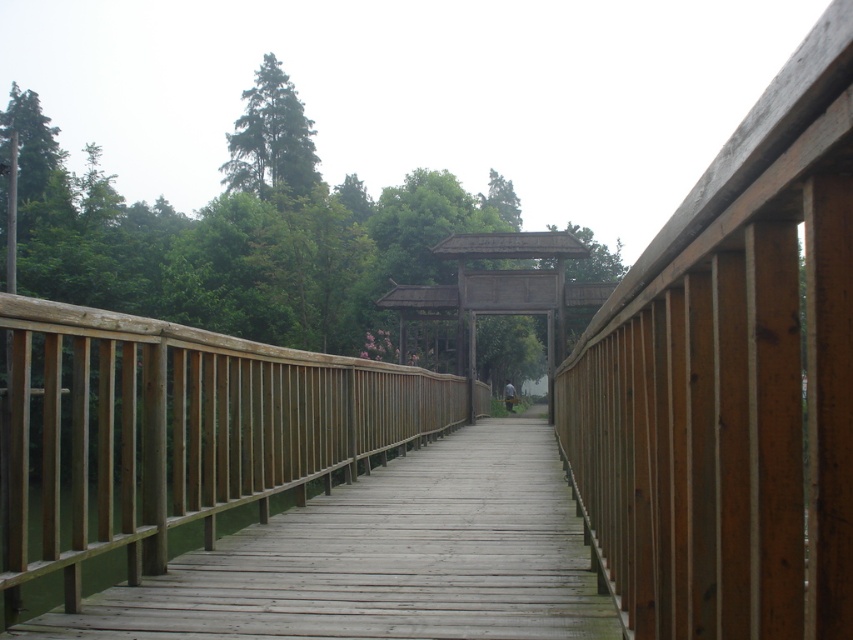
Is wooden at center below green matte tree at upper center?

Yes, wooden at center is below green matte tree at upper center.

Which is in front, point (497, 420) or point (228, 189)?

Point (497, 420) is more forward.

At what (x,y) coordinates should I click in order to perform the action: click on wooden at center. Please return your answer as a coordinate pair (x, y). The height and width of the screenshot is (640, 853). Looking at the image, I should click on (386, 557).

The image size is (853, 640). What are the coordinates of `wooden at center` in the screenshot? It's located at (386, 557).

Is wooden at center behind wooden gate at center?

No, wooden at center is closer to the viewer.

Is wooden at center below wooden gate at center?

Indeed, wooden at center is positioned under wooden gate at center.

Who is more forward, (476, 625) or (503, 257)?

Point (476, 625) is more forward.

This screenshot has width=853, height=640. I want to click on wooden at center, so pyautogui.click(x=386, y=557).

Find the location of `wooden gate at center`. wooden gate at center is located at coordinates (502, 291).

Is wooden gate at center positioned at the back of green matte tree at upper center?

No, it is in front of green matte tree at upper center.

Which is behind, point (465, 310) or point (271, 177)?

The point (271, 177) is more distant.

The image size is (853, 640). I want to click on wooden gate at center, so click(502, 291).